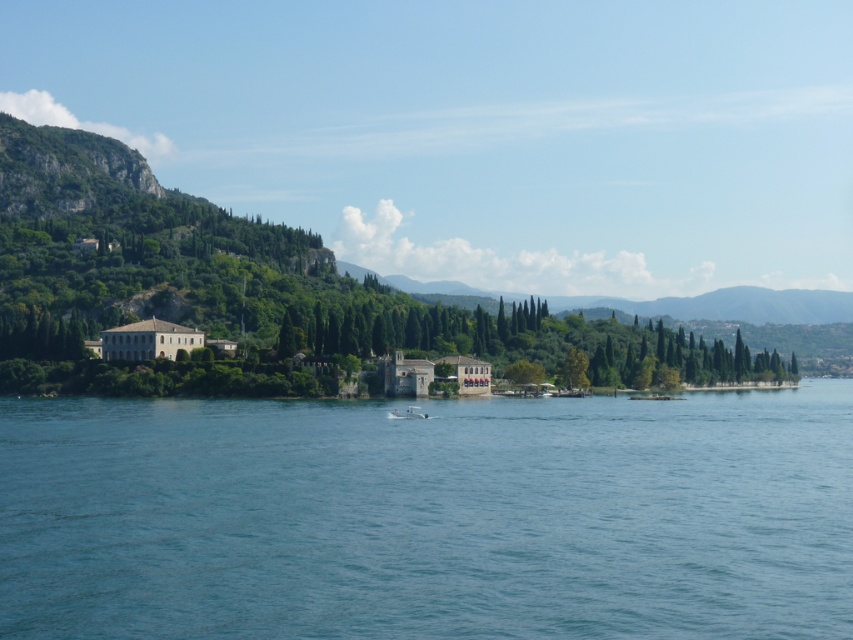
You are standing on the lakeside and want to know if the blue water at center is taller than the white plastic boat at center. Can you confirm this?

The blue water at center has a greater height compared to the white plastic boat at center, so yes, the blue water at center is taller than the white plastic boat at center.

You are a photographer planning to capture a wide shot of the lakeside scene. Your camera has a lens that can focus on objects up to 10 meters apart. Given the blue water at center and the green leafy tree at center, can you confirm if both will fit within the frame without needing to adjust the lens focus?

The blue water at center might be wider than green leafy tree at center, but since both are at the same central area, they are likely within the 10 meters focus range of the camera lens, so they should fit in the frame without adjustment.